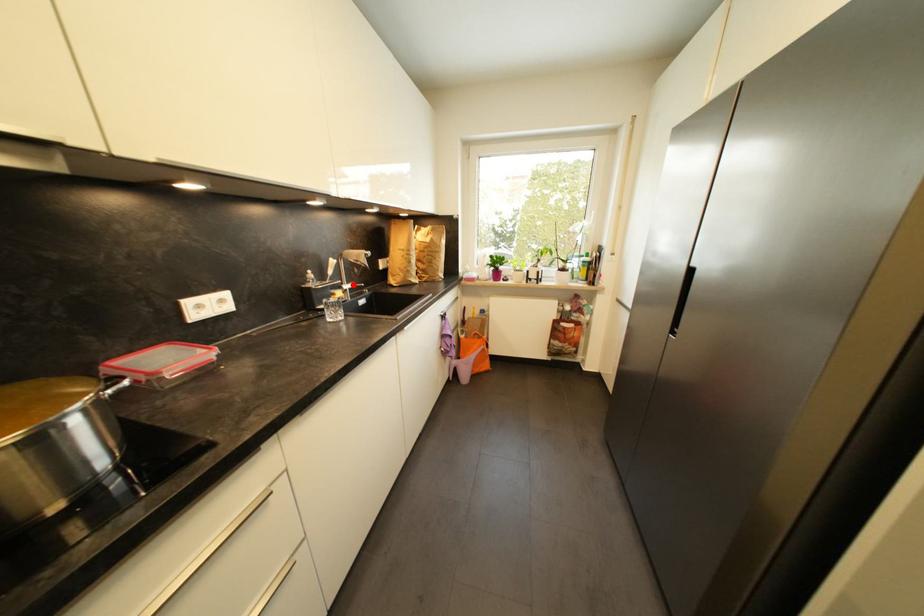
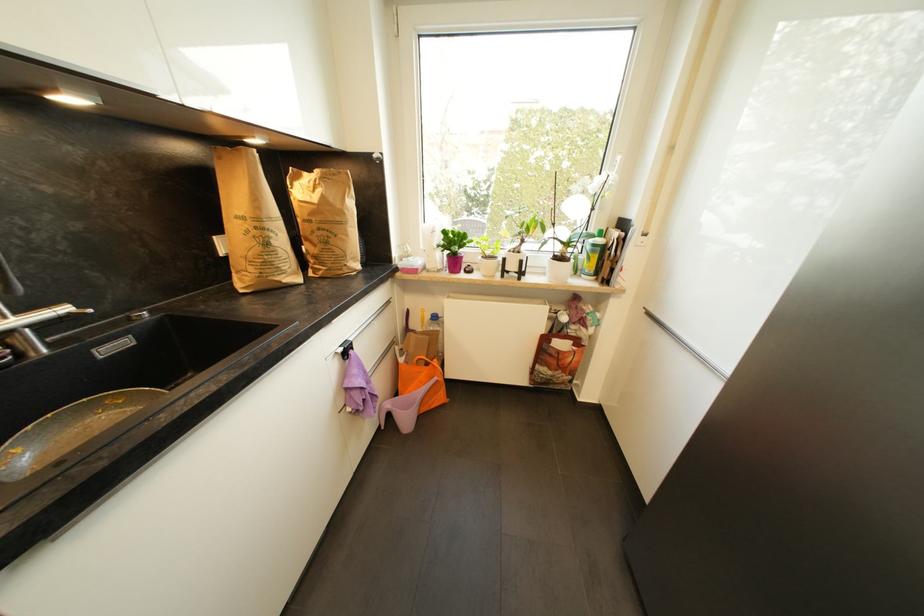
In the second image, find the point that corresponds to the highlighted location in the first image.

(27, 313)